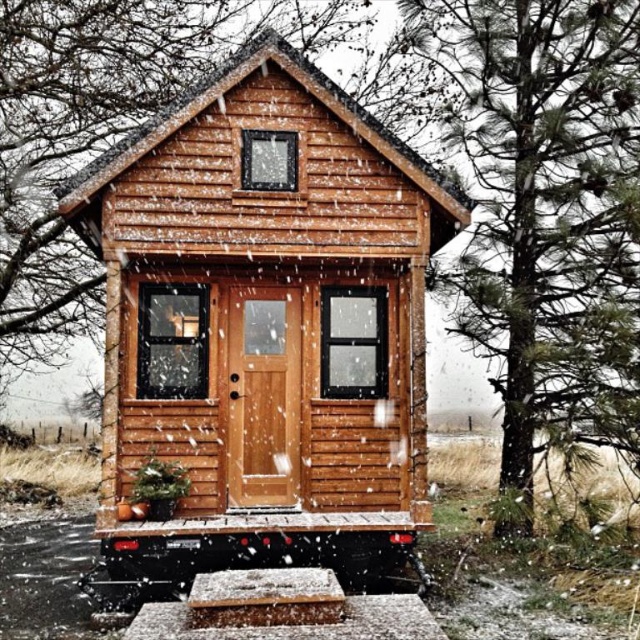
Can you confirm if matte wood log cabin at center is bigger than green pine tree at right?

Actually, matte wood log cabin at center might be smaller than green pine tree at right.

Describe the element at coordinates (262, 324) in the screenshot. I see `matte wood log cabin at center` at that location.

Does point (264, 317) lie behind point (538, 42)?

That is False.

At what (x,y) coordinates should I click in order to perform the action: click on matte wood log cabin at center. Please return your answer as a coordinate pair (x, y). The height and width of the screenshot is (640, 640). Looking at the image, I should click on (262, 324).